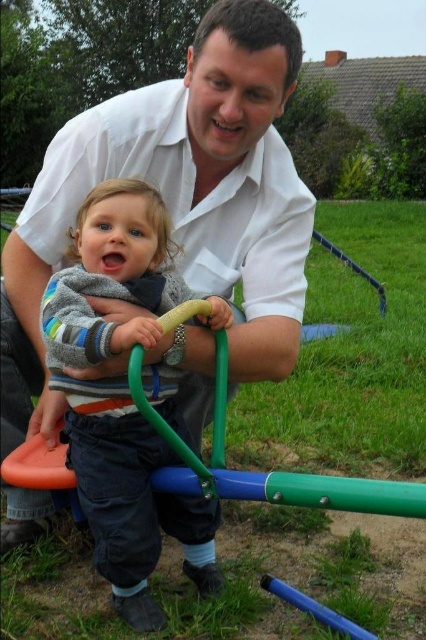
Question: Considering the relative positions of white smooth shirt at upper center and green plastic bar at center in the image provided, where is white smooth shirt at upper center located with respect to green plastic bar at center?

Choices:
 (A) below
 (B) above

Answer: (B)

Question: Among these points, which one is farthest from the camera?

Choices:
 (A) (293, 72)
 (B) (51, 481)

Answer: (A)

Question: Can you confirm if white smooth shirt at upper center is positioned below green plastic bar at center?

Choices:
 (A) no
 (B) yes

Answer: (A)

Question: Considering the real-world distances, which object is closest to the green plastic bar at center?

Choices:
 (A) striped cotton sweater at center
 (B) white smooth shirt at upper center

Answer: (A)

Question: Among these objects, which one is farthest from the camera?

Choices:
 (A) green plastic bar at center
 (B) white smooth shirt at upper center
 (C) striped cotton sweater at center

Answer: (B)

Question: Does white smooth shirt at upper center have a smaller size compared to green plastic bar at center?

Choices:
 (A) no
 (B) yes

Answer: (A)